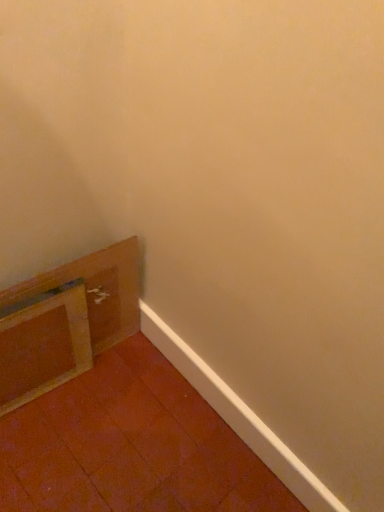
Question: Should I look upward or downward to see brown cardboard box at lower left?

Choices:
 (A) up
 (B) down

Answer: (B)